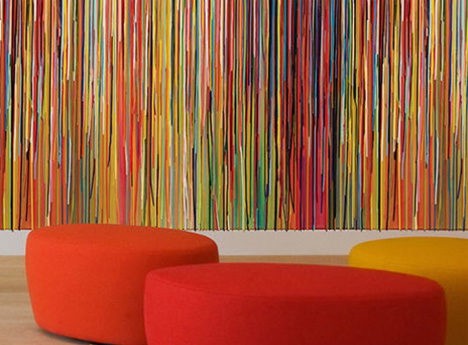
Image resolution: width=468 pixels, height=345 pixels. I want to click on red ottoman, so click(279, 263).